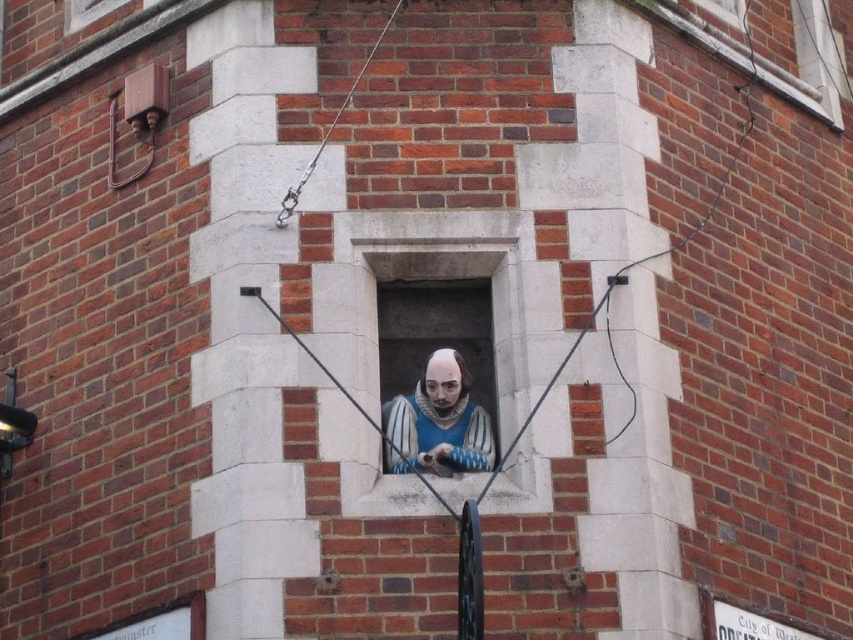
Question: Is matte blue fabric at center thinner than white stone window at upper right?

Choices:
 (A) no
 (B) yes

Answer: (B)

Question: Estimate the real-world distances between objects in this image. Which object is closer to the white stone window at upper center?

Choices:
 (A) white stone window at upper right
 (B) matte blue fabric at center

Answer: (A)

Question: Estimate the real-world distances between objects in this image. Which object is closer to the white stone window at upper right?

Choices:
 (A) matte blue fabric at center
 (B) white stone window at upper center

Answer: (A)

Question: Can you confirm if white stone window at upper right is thinner than white stone window at upper center?

Choices:
 (A) no
 (B) yes

Answer: (A)

Question: Which point appears farthest from the camera in this image?

Choices:
 (A) (646, 10)
 (B) (108, 12)

Answer: (B)

Question: Is matte blue fabric at center positioned before white stone window at upper center?

Choices:
 (A) no
 (B) yes

Answer: (B)